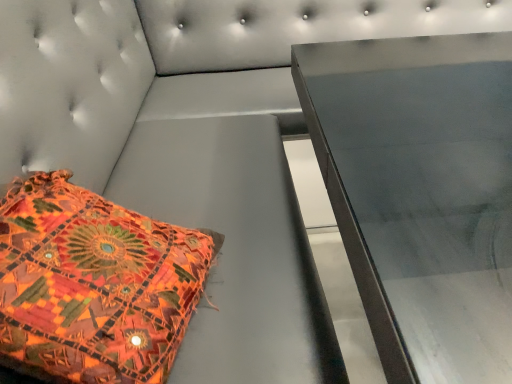
In order to face metallic table at center, should I rotate leftwards or rightwards?

You should look right and rotate roughly 29.366 degrees.

Measure the distance between point (503, 374) and camera.

The distance of point (503, 374) from camera is 13.54 inches.

Image resolution: width=512 pixels, height=384 pixels. What do you see at coordinates (421, 193) in the screenshot?
I see `metallic table at center` at bounding box center [421, 193].

Locate an element on the screen. The width and height of the screenshot is (512, 384). metallic table at center is located at coordinates (421, 193).

Find the location of a particular element. This screenshot has height=384, width=512. textured fabric pillow at lower left is located at coordinates (93, 284).

In order to face textured fabric pillow at lower left, should I rotate leftwards or rightwards?

To face it directly, rotate left by 21.049 degrees.

The width and height of the screenshot is (512, 384). What do you see at coordinates (93, 284) in the screenshot? I see `textured fabric pillow at lower left` at bounding box center [93, 284].

What is the approximate width of textured fabric pillow at lower left?

textured fabric pillow at lower left is 14.55 inches in width.

At what (x,y) coordinates should I click in order to perform the action: click on metallic table at center. Please return your answer as a coordinate pair (x, y). Looking at the image, I should click on (421, 193).

Is metallic table at center at the left side of textured fabric pillow at lower left?

No, metallic table at center is not to the left of textured fabric pillow at lower left.

In the image, is metallic table at center positioned in front of or behind textured fabric pillow at lower left?

metallic table at center is positioned farther from the viewer than textured fabric pillow at lower left.

Does point (488, 345) appear closer or farther from the camera than point (109, 229)?

Point (488, 345) is closer to the camera than point (109, 229).

From the image's perspective, is metallic table at center over textured fabric pillow at lower left?

No, from the image's perspective, metallic table at center is not over textured fabric pillow at lower left.

From a real-world perspective, is metallic table at center physically above textured fabric pillow at lower left?

Incorrect, from a real-world perspective, metallic table at center is lower than textured fabric pillow at lower left.

Can you confirm if metallic table at center is wider than textured fabric pillow at lower left?

Yes.

Does metallic table at center have a lesser height compared to textured fabric pillow at lower left?

No.

Who is bigger, metallic table at center or textured fabric pillow at lower left?

Bigger between the two is metallic table at center.

Would you say metallic table at center is outside textured fabric pillow at lower left?

Absolutely, metallic table at center is external to textured fabric pillow at lower left.

Is metallic table at center beside textured fabric pillow at lower left?

No, metallic table at center is not in contact with textured fabric pillow at lower left.

Is metallic table at center turned away from textured fabric pillow at lower left?

Yes, metallic table at center is positioned with its back facing textured fabric pillow at lower left.

How many degrees apart are the facing directions of metallic table at center and textured fabric pillow at lower left?

1.38 degrees separate the facing orientations of metallic table at center and textured fabric pillow at lower left.

How much distance is there between metallic table at center and textured fabric pillow at lower left?

A distance of 16.17 inches exists between metallic table at center and textured fabric pillow at lower left.

Where is `pillow above the metallic table at center (from a real-world perspective)`? Image resolution: width=512 pixels, height=384 pixels. pillow above the metallic table at center (from a real-world perspective) is located at coordinates (93, 284).

Which object is positioned more to the right, textured fabric pillow at lower left or metallic table at center?

metallic table at center is more to the right.

Is textured fabric pillow at lower left in front of or behind metallic table at center in the image?

In the image, textured fabric pillow at lower left appears in front of metallic table at center.

Does point (76, 244) appear closer or farther from the camera than point (367, 289)?

Clearly, point (76, 244) is more distant from the camera than point (367, 289).

From the image's perspective, would you say textured fabric pillow at lower left is shown under metallic table at center?

No, from the image's perspective, textured fabric pillow at lower left is not below metallic table at center.

From a real-world perspective, who is located lower, textured fabric pillow at lower left or metallic table at center?

In real-world perspective, metallic table at center is lower.

Which object is thinner, textured fabric pillow at lower left or metallic table at center?

textured fabric pillow at lower left is thinner.

From the picture: Who is shorter, textured fabric pillow at lower left or metallic table at center?

textured fabric pillow at lower left.

Is textured fabric pillow at lower left bigger than metallic table at center?

Answer: Actually, textured fabric pillow at lower left might be smaller than metallic table at center.

Would you say textured fabric pillow at lower left is outside metallic table at center?

Indeed, textured fabric pillow at lower left is completely outside metallic table at center.

Are textured fabric pillow at lower left and metallic table at center far apart?

They are positioned close to each other.

Is textured fabric pillow at lower left positioned with its back to metallic table at center?

textured fabric pillow at lower left is not turned away from metallic table at center.

Where is `pillow that is on the left side of metallic table at center`? pillow that is on the left side of metallic table at center is located at coordinates (93, 284).

Where is `furniture below the textured fabric pillow at lower left (from the image's perspective)`? furniture below the textured fabric pillow at lower left (from the image's perspective) is located at coordinates (421, 193).

You are a GUI agent. You are given a task and a screenshot of the screen. Output one action in this format:
    pyautogui.click(x=<x>, y=<y>)
    Task: Click on the pillow on the left of metallic table at center
    The height and width of the screenshot is (384, 512).
    Given the screenshot: What is the action you would take?
    pyautogui.click(x=93, y=284)